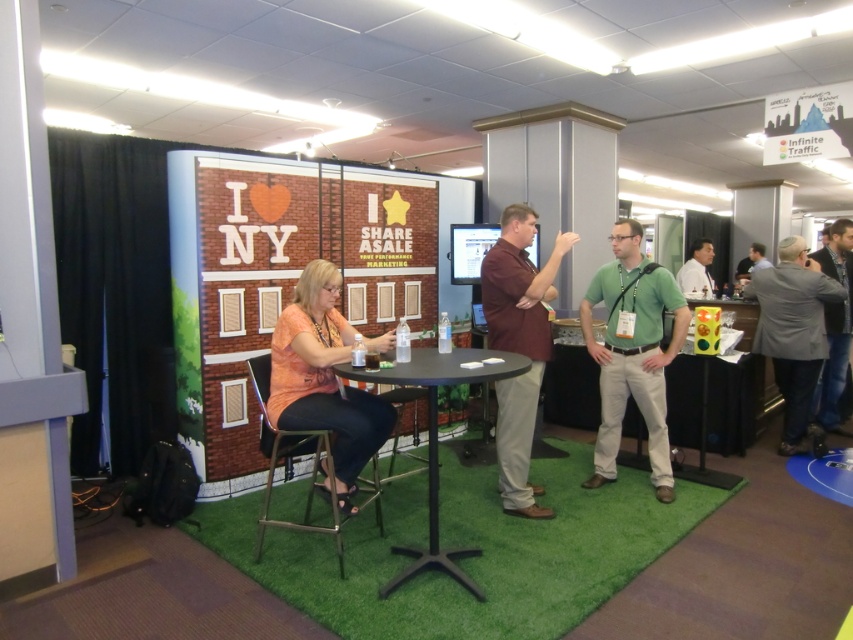
You are organizing a booth at a trade show and need to place a promotional stand that requires 1.2 meters of space. Given the green cotton shirt at center and the black plastic table at center, which object has enough width to accommodate the stand?

The black plastic table at center has sufficient width since its width is greater than the green cotton shirt at center, which is less than 1.2 meters.

You are organizing a booth at an event and need to decide where to place promotional materials. The booth has limited space. Which object, the gray fabric jacket at right or the white shirt at center, should you place first to maximize space efficiency?

The gray fabric jacket at right is larger in size than the white shirt at center, so you should place the gray fabric jacket at right first to maximize space efficiency by prioritizing larger items.